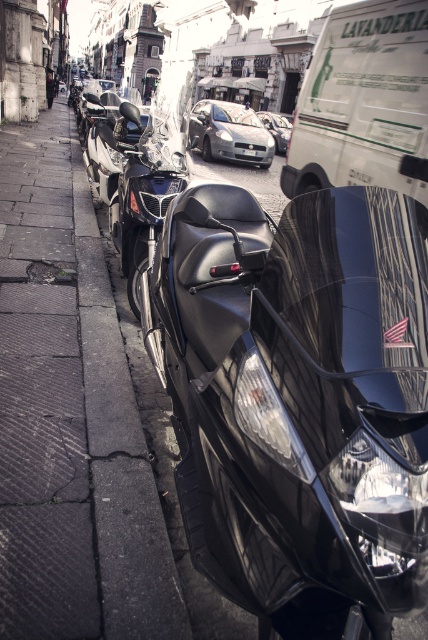
Question: Can you confirm if satin silver car at center is positioned above white plastic license plate at center?

Choices:
 (A) no
 (B) yes

Answer: (B)

Question: Which of these objects is positioned closest to the dark concrete pavement at left?

Choices:
 (A) shiny silver sports car at center
 (B) glossy black motorcycle at center

Answer: (B)

Question: Which object is closer to the camera taking this photo?

Choices:
 (A) shiny silver sports car at center
 (B) satin silver car at center

Answer: (B)

Question: Which point is closer to the camera?

Choices:
 (A) dark concrete pavement at left
 (B) glossy black motorcycle at center

Answer: (B)

Question: Is dark concrete pavement at left smaller than white plastic license plate at center?

Choices:
 (A) no
 (B) yes

Answer: (A)

Question: Can you confirm if dark concrete pavement at left is positioned below shiny silver sports car at center?

Choices:
 (A) no
 (B) yes

Answer: (B)